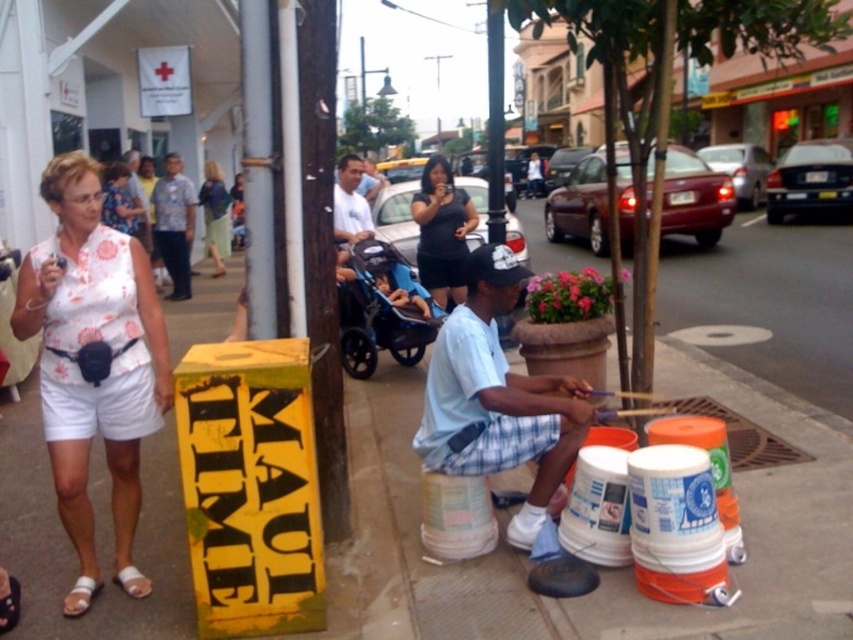
Consider the image. Is printed fabric shirt at center positioned behind matte blue shirt at center?

Yes, it is behind matte blue shirt at center.

Does printed fabric shirt at center appear under matte blue shirt at center?

No.

The height and width of the screenshot is (640, 853). In order to click on printed fabric shirt at center in this screenshot , I will do `click(173, 224)`.

Is the position of matte black dress at center less distant than that of light blue shirt at center?

Yes, matte black dress at center is closer to the viewer.

Which is more to the left, matte black dress at center or light blue shirt at center?

light blue shirt at center is more to the left.

Is point (416, 198) in front of point (132, 228)?

Yes, it is.

The height and width of the screenshot is (640, 853). Find the location of `matte black dress at center`. matte black dress at center is located at coordinates (442, 230).

How much distance is there between white cotton shorts at lower left and printed fabric shirt at center?

white cotton shorts at lower left and printed fabric shirt at center are 7.64 meters apart.

Is white cotton shorts at lower left further to camera compared to printed fabric shirt at center?

No, white cotton shorts at lower left is closer to the viewer.

The height and width of the screenshot is (640, 853). What do you see at coordinates (93, 364) in the screenshot? I see `white cotton shorts at lower left` at bounding box center [93, 364].

This screenshot has width=853, height=640. I want to click on white cotton shorts at lower left, so click(x=93, y=364).